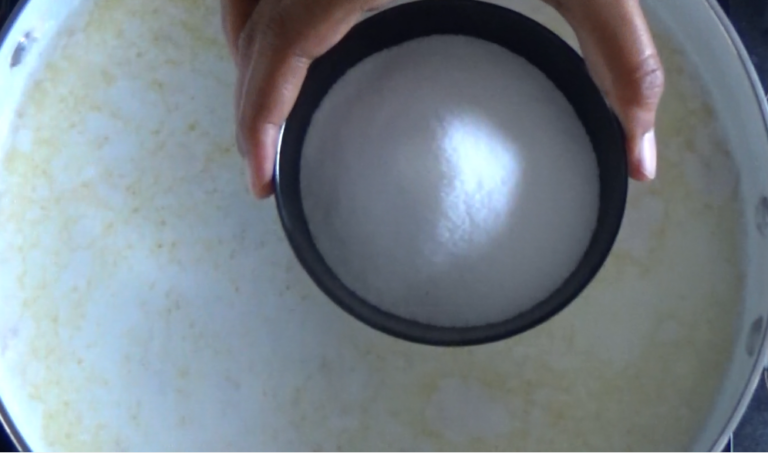
Locate an element on the screen. The height and width of the screenshot is (453, 768). black bowl is located at coordinates (312, 258).